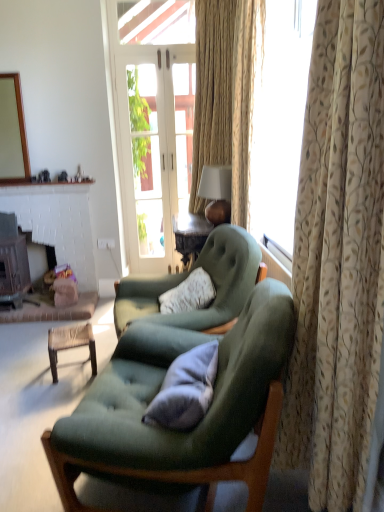
Locate an element on the screen. This screenshot has height=512, width=384. free spot to the right of dark brown wood fireplace at left, the 2th fireplace viewed from the right is located at coordinates (44, 304).